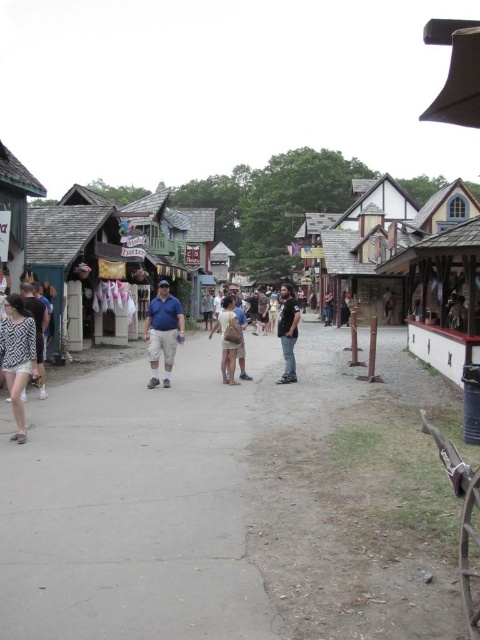
Question: Is matte blue shirt at center bigger than tan cotton shorts at center?

Choices:
 (A) no
 (B) yes

Answer: (A)

Question: Which point is farther from the camera taking this photo?

Choices:
 (A) (226, 296)
 (B) (226, 483)

Answer: (A)

Question: Can you confirm if black cotton shirt at center is positioned above tan cotton shorts at center?

Choices:
 (A) no
 (B) yes

Answer: (B)

Question: Which point appears farthest from the camera in this image?

Choices:
 (A) (217, 538)
 (B) (286, 362)
 (C) (2, 364)
 (D) (228, 312)

Answer: (B)

Question: Is gray concrete pavement at center thinner than matte blue shirt at center?

Choices:
 (A) no
 (B) yes

Answer: (A)

Question: Which object is positioned closest to the black cotton shirt at center?

Choices:
 (A) tan cotton shorts at center
 (B) matte blue shirt at center
 (C) patterned fabric dress at left
 (D) gray concrete pavement at center

Answer: (D)